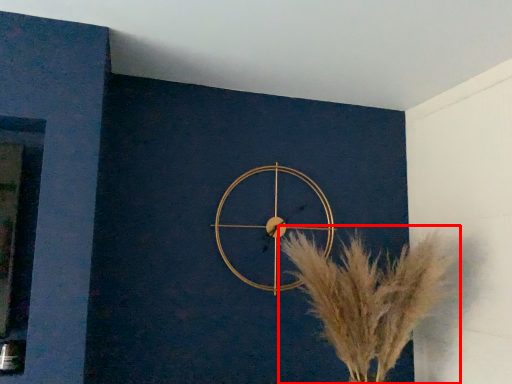
Question: Where is flower (annotated by the red box) located in relation to wall clock in the image?

Choices:
 (A) right
 (B) left

Answer: (A)